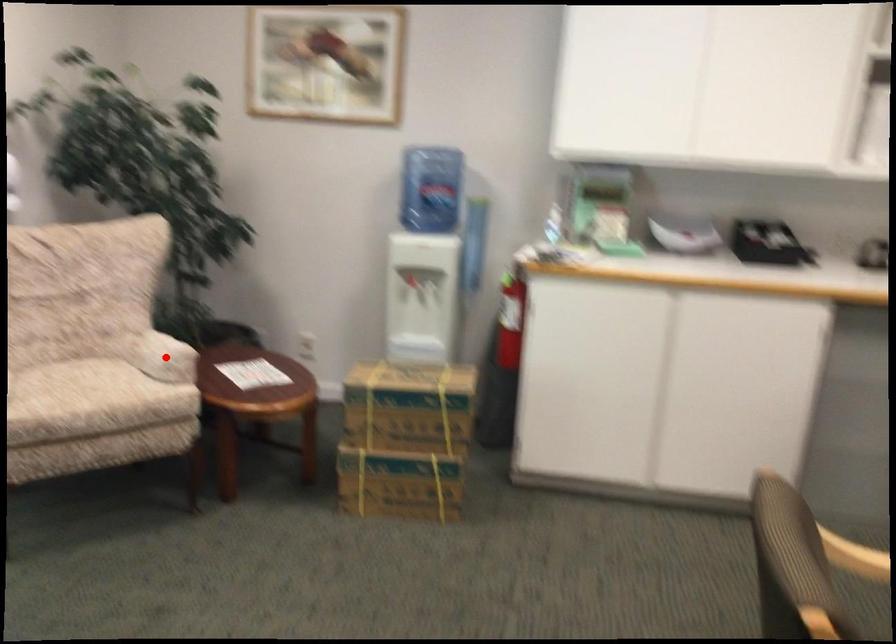
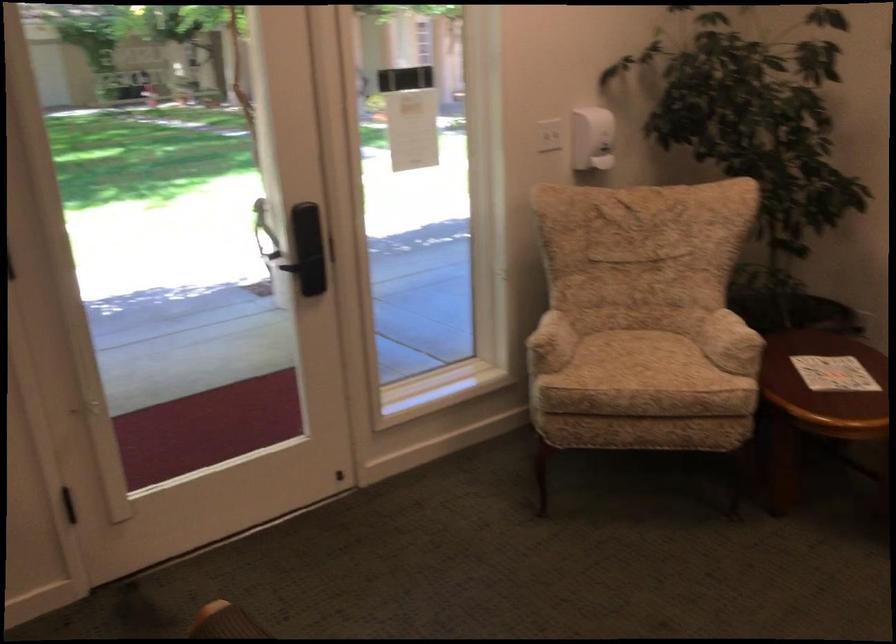
Question: A red point is marked in image1. In image2, is the corresponding 3D point closer to the camera or farther? Reply with the corresponding letter.

Choices:
 (A) The corresponding 3D point is closer.
 (B) The corresponding 3D point is farther.

Answer: (A)